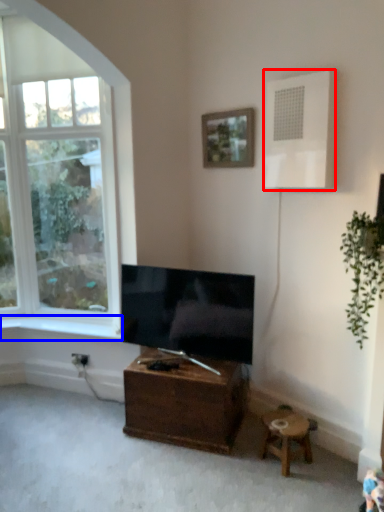
Question: Which of the following is the closest to the observer, air conditioner (highlighted by a red box) or window sill (highlighted by a blue box)?

Choices:
 (A) air conditioner
 (B) window sill

Answer: (A)